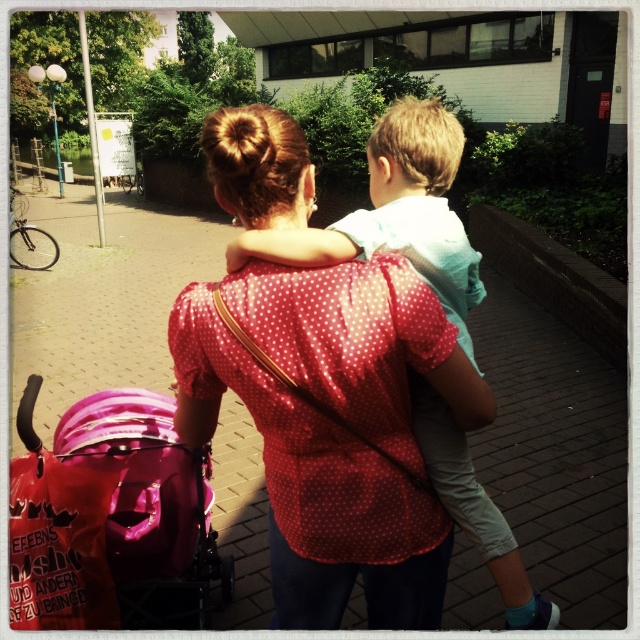
You are a photographer trying to capture a candid shot of the stroller with the pink cover and red bag. You notice a specific point at coordinates (x=112, y=518). Where is this point located in relation to the pink fabric baby carriage at lower left?

The point (x=112, y=518) is located on the pink fabric baby carriage at lower left.

What is located at the point with coordinates (556, 452) in the image?

The point at coordinates (556, 452) marks brick pavement at center.